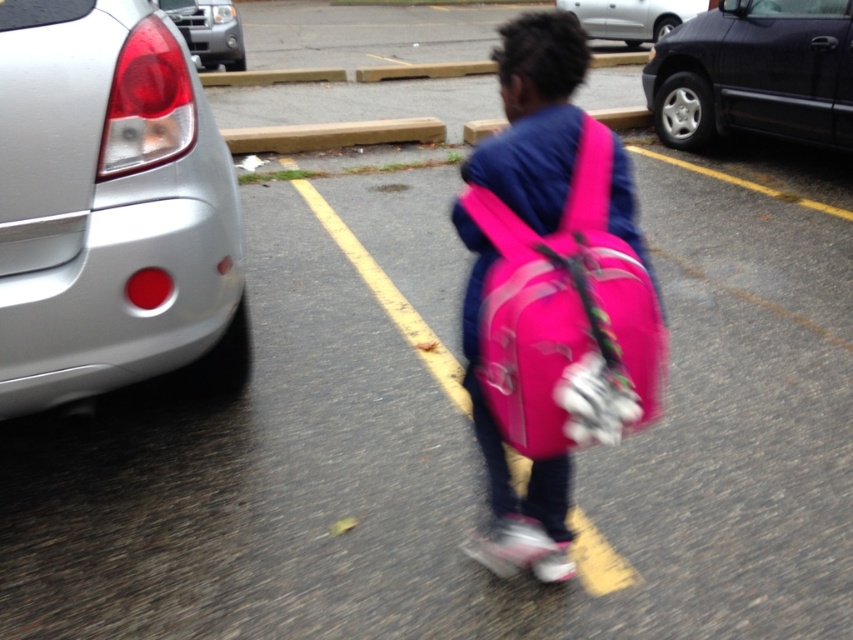
Question: Which point is farther from the camera taking this photo?

Choices:
 (A) tap(235, 44)
 (B) tap(114, 129)

Answer: (A)

Question: Observing the image, what is the correct spatial positioning of silver metallic car at left in reference to metallic silver truck at upper left?

Choices:
 (A) above
 (B) below

Answer: (B)

Question: Estimate the real-world distances between objects in this image. Which object is closer to the silver metallic car at upper center?

Choices:
 (A) pink fabric backpack at center
 (B) silver metallic car at left

Answer: (B)

Question: Is dark gray metallic van at upper right smaller than metallic silver truck at upper left?

Choices:
 (A) no
 (B) yes

Answer: (A)

Question: Which point is closer to the camera?

Choices:
 (A) (701, 1)
 (B) (672, 52)

Answer: (B)

Question: Observing the image, what is the correct spatial positioning of silver metallic car at upper center in reference to metallic silver truck at upper left?

Choices:
 (A) above
 (B) below

Answer: (A)